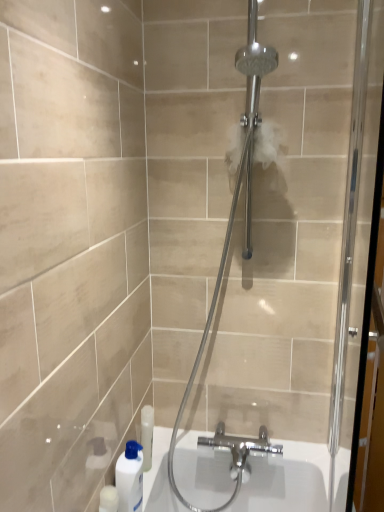
Question: Is white glossy bottle at lower left oriented away from clear glass shower door at center?

Choices:
 (A) yes
 (B) no

Answer: (B)

Question: Can you confirm if white glossy bottle at lower left is positioned to the left of clear glass shower door at center?

Choices:
 (A) no
 (B) yes

Answer: (B)

Question: Does white glossy bottle at lower left have a lesser width compared to clear glass shower door at center?

Choices:
 (A) no
 (B) yes

Answer: (B)

Question: Is white glossy bottle at lower left located outside clear glass shower door at center?

Choices:
 (A) no
 (B) yes

Answer: (B)

Question: Is white glossy bottle at lower left in front of clear glass shower door at center?

Choices:
 (A) yes
 (B) no

Answer: (B)

Question: Would you say clear glass screen door at right is inside or outside clear glass shower door at center?

Choices:
 (A) inside
 (B) outside

Answer: (B)

Question: Considering the positions of clear glass screen door at right and clear glass shower door at center in the image, is clear glass screen door at right wider or thinner than clear glass shower door at center?

Choices:
 (A) wide
 (B) thin

Answer: (B)

Question: Does point (350, 209) appear closer or farther from the camera than point (195, 276)?

Choices:
 (A) farther
 (B) closer

Answer: (B)

Question: Is clear glass screen door at right taller or shorter than clear glass shower door at center?

Choices:
 (A) short
 (B) tall

Answer: (A)

Question: From the image's perspective, is clear glass shower door at center located above or below clear glass screen door at right?

Choices:
 (A) below
 (B) above

Answer: (B)

Question: Looking at their shapes, would you say clear glass shower door at center is wider or thinner than clear glass screen door at right?

Choices:
 (A) wide
 (B) thin

Answer: (A)

Question: Choose the correct answer: Is clear glass shower door at center inside clear glass screen door at right or outside it?

Choices:
 (A) inside
 (B) outside

Answer: (B)

Question: Considering the positions of clear glass shower door at center and clear glass screen door at right in the image, is clear glass shower door at center bigger or smaller than clear glass screen door at right?

Choices:
 (A) small
 (B) big

Answer: (B)

Question: Is clear glass shower door at center situated inside white glossy bottle at lower left or outside?

Choices:
 (A) inside
 (B) outside

Answer: (B)

Question: From a real-world perspective, is clear glass shower door at center positioned above or below white glossy bottle at lower left?

Choices:
 (A) above
 (B) below

Answer: (A)